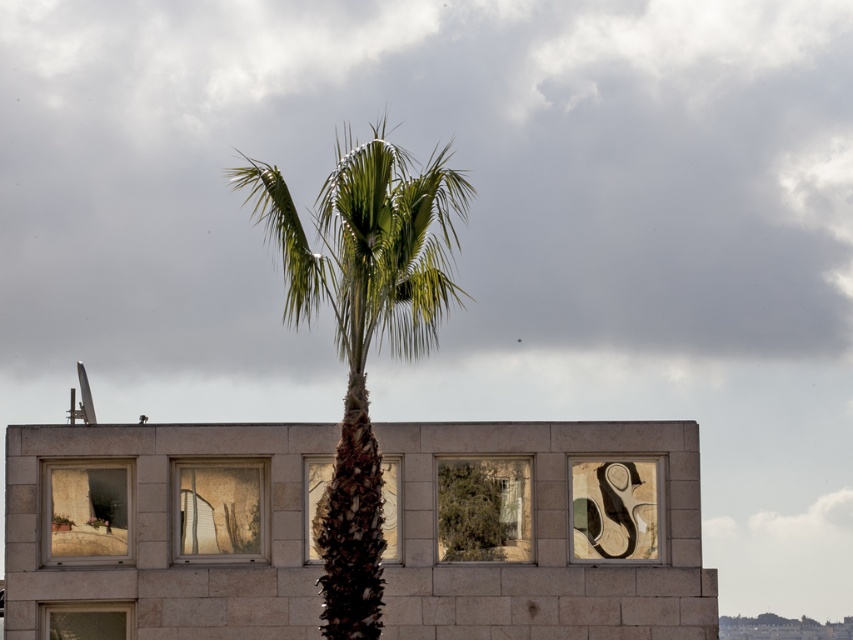
You are an architect designing a new building. You observe the green leafy palm tree at center and the green leafy tree at center in the image. Which one is positioned higher in the scene?

The green leafy palm tree at center is located above the green leafy tree at center, so it is positioned higher in the scene.

You are standing in front of the palm tree and want to touch the point at coordinates (363, 324). Based on the scene description, is this point located on the palm tree or the building?

The point at coordinates (363, 324) is on the green leafy palm tree at center, so yes, it is located on the palm tree.